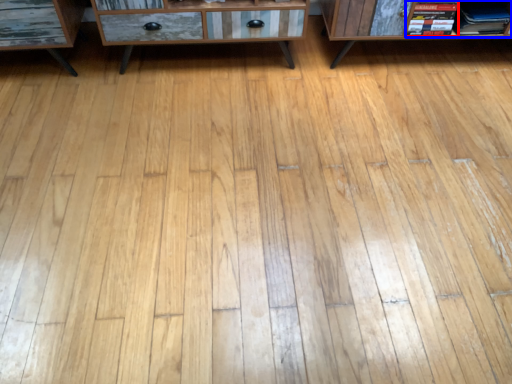
Question: Which object appears farthest to the camera in this image, book (highlighted by a red box) or book (highlighted by a blue box)?

Choices:
 (A) book
 (B) book

Answer: (B)